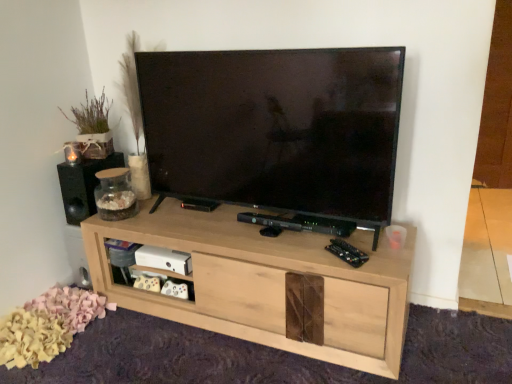
Identify the location of black matte speaker at left. (83, 185).

Describe the element at coordinates (83, 185) in the screenshot. I see `black matte speaker at left` at that location.

The width and height of the screenshot is (512, 384). What do you see at coordinates (269, 284) in the screenshot?
I see `natural wood cabinet at center` at bounding box center [269, 284].

The width and height of the screenshot is (512, 384). I want to click on natural wood cabinet at center, so click(269, 284).

What is the approximate width of natural wood cabinet at center?

natural wood cabinet at center is 49.48 centimeters in width.

Locate an element on the screen. Image resolution: width=512 pixels, height=384 pixels. black matte speaker at left is located at coordinates click(x=83, y=185).

Consider the image. Is black matte speaker at left to the left or to the right of natural wood cabinet at center in the image?

black matte speaker at left is positioned on natural wood cabinet at center's left side.

Is the depth of black matte speaker at left less than that of natural wood cabinet at center?

No, it is not.

Is point (75, 204) behind point (395, 290)?

Yes.

From the image's perspective, which one is positioned lower, black matte speaker at left or natural wood cabinet at center?

From the image's view, natural wood cabinet at center is below.

From a real-world perspective, which object rests below the other?

From a 3D spatial view, natural wood cabinet at center is below.

Which of these two, black matte speaker at left or natural wood cabinet at center, is thinner?

black matte speaker at left.

Between black matte speaker at left and natural wood cabinet at center, which one has more height?

Standing taller between the two is natural wood cabinet at center.

Considering the sizes of black matte speaker at left and natural wood cabinet at center in the image, is black matte speaker at left bigger or smaller than natural wood cabinet at center?

In the image, black matte speaker at left appears to be smaller than natural wood cabinet at center.

Would you say black matte speaker at left contains natural wood cabinet at center?

No, black matte speaker at left does not contain natural wood cabinet at center.

Is black matte speaker at left next to natural wood cabinet at center?

black matte speaker at left and natural wood cabinet at center are not in contact.

Could you tell me if black matte speaker at left is turned towards natural wood cabinet at center?

No, black matte speaker at left is not turned towards natural wood cabinet at center.

At what (x,y) coordinates should I click in order to perform the action: click on speaker located behind the natural wood cabinet at center. Please return your answer as a coordinate pair (x, y). This screenshot has width=512, height=384. Looking at the image, I should click on (83, 185).

Between natural wood cabinet at center and black matte speaker at left, which one appears on the right side from the viewer's perspective?

natural wood cabinet at center is more to the right.

Considering their positions, is natural wood cabinet at center located in front of or behind black matte speaker at left?

natural wood cabinet at center is positioned closer to the viewer than black matte speaker at left.

Is point (266, 295) closer or farther from the camera than point (64, 192)?

Point (266, 295).

From the image's perspective, does natural wood cabinet at center appear lower than black matte speaker at left?

Correct, natural wood cabinet at center appears lower than black matte speaker at left in the image.

From a real-world perspective, is natural wood cabinet at center physically located above or below black matte speaker at left?

natural wood cabinet at center is situated lower than black matte speaker at left in the real world.

Which object is wider, natural wood cabinet at center or black matte speaker at left?

With larger width is natural wood cabinet at center.

Can you confirm if natural wood cabinet at center is shorter than black matte speaker at left?

Incorrect, the height of natural wood cabinet at center does not fall short of that of black matte speaker at left.

Does natural wood cabinet at center have a smaller size compared to black matte speaker at left?

Actually, natural wood cabinet at center might be larger than black matte speaker at left.

Is natural wood cabinet at center outside of black matte speaker at left?

Yes.

Are natural wood cabinet at center and black matte speaker at left beside each other?

No, natural wood cabinet at center is not with black matte speaker at left.

Is natural wood cabinet at center facing towards black matte speaker at left?

No, natural wood cabinet at center is not oriented towards black matte speaker at left.

What are the coordinates of `shelf on the right of black matte speaker at left` in the screenshot? It's located at (269, 284).

Image resolution: width=512 pixels, height=384 pixels. In order to click on shelf directly beneath the black matte speaker at left (from a real-world perspective) in this screenshot , I will do `click(269, 284)`.

The height and width of the screenshot is (384, 512). Find the location of `speaker behind the natural wood cabinet at center`. speaker behind the natural wood cabinet at center is located at coordinates (83, 185).